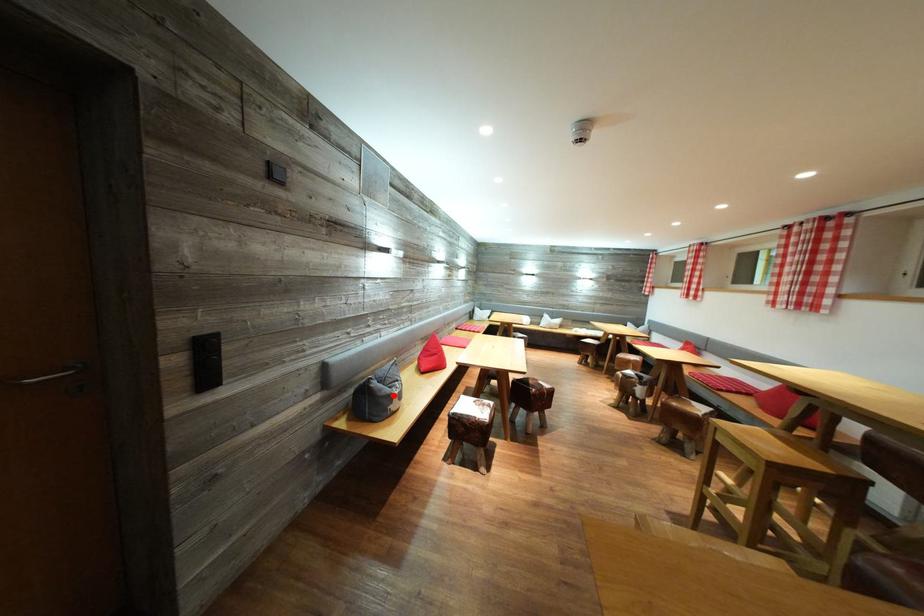
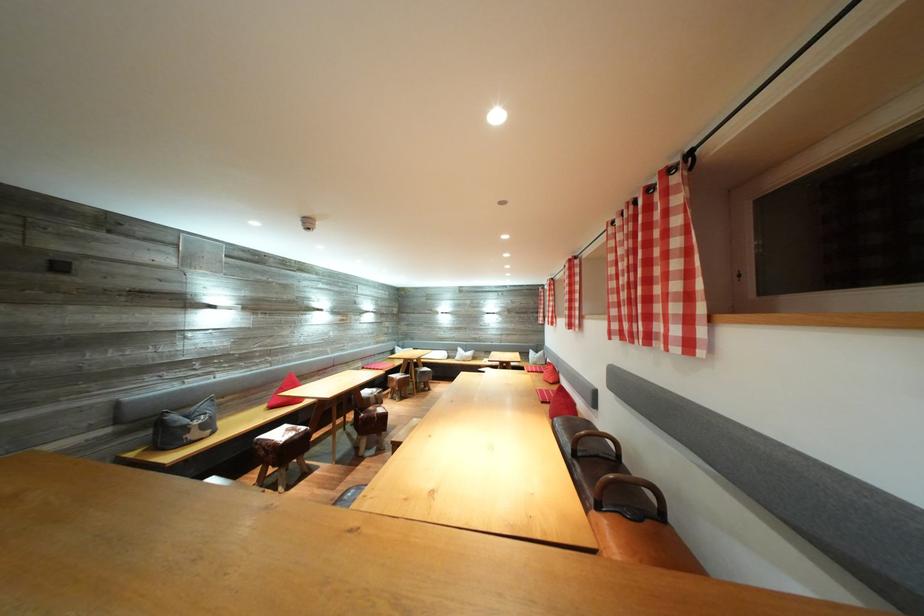
Find the pixel in the second image that matches the highlighted location in the first image.

(192, 427)